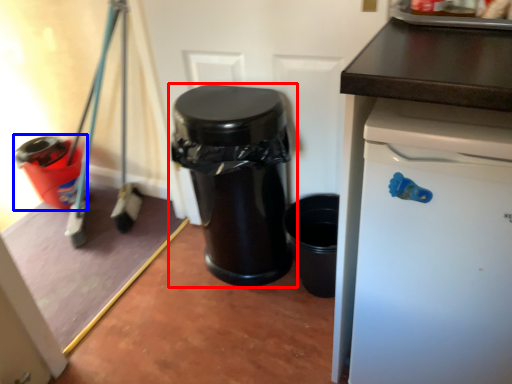
Question: Which point is further to the camera, waste container (highlighted by a red box) or waste container (highlighted by a blue box)?

Choices:
 (A) waste container
 (B) waste container

Answer: (B)